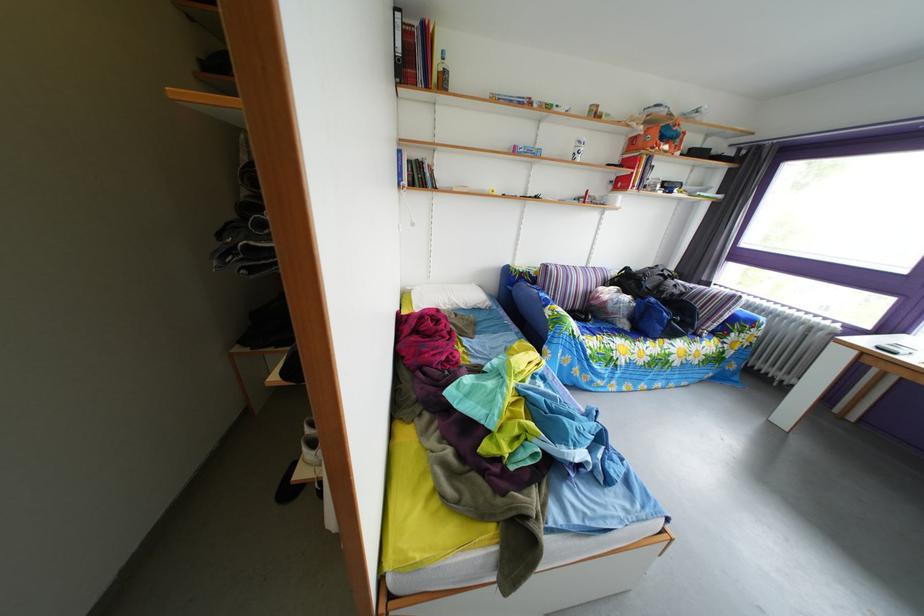
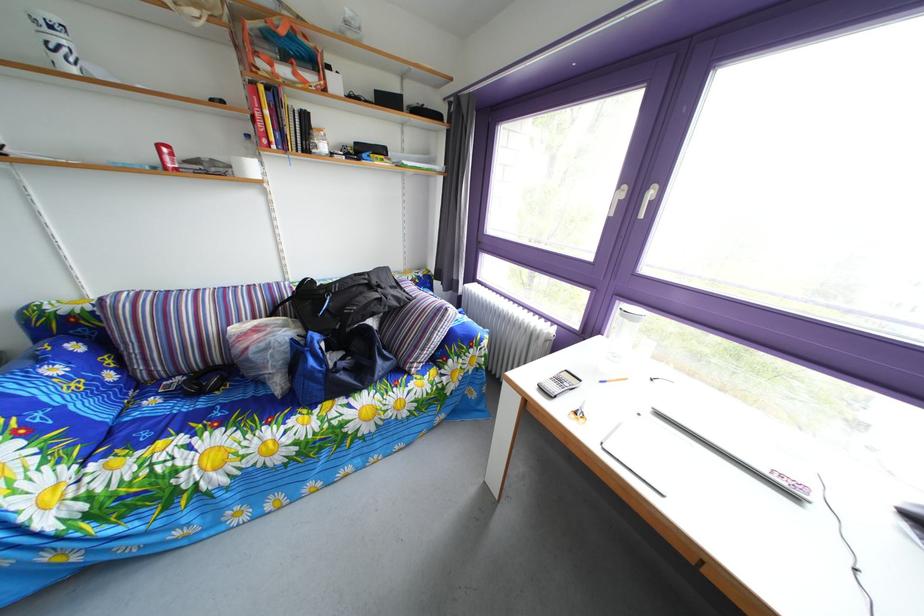
Question: What movement of the cameraman would produce the second image?

Choices:
 (A) Left
 (B) Right
 (C) Forward
 (D) Backward

Answer: (B)